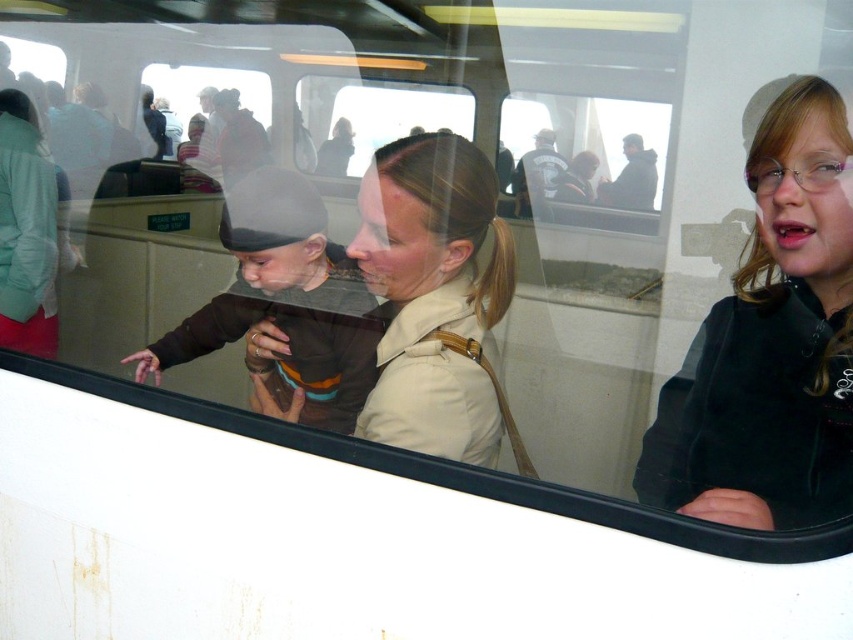
Who is positioned more to the left, beige leather jacket at center or dark gray jacket at upper center?

beige leather jacket at center is more to the left.

In the scene shown: Can you confirm if beige leather jacket at center is taller than dark gray jacket at upper center?

Yes, beige leather jacket at center is taller than dark gray jacket at upper center.

Describe the element at coordinates (433, 292) in the screenshot. Image resolution: width=853 pixels, height=640 pixels. I see `beige leather jacket at center` at that location.

Image resolution: width=853 pixels, height=640 pixels. I want to click on beige leather jacket at center, so click(433, 292).

Between matte brown hat at left and dark gray jacket at upper center, which one is positioned higher?

Positioned higher is dark gray jacket at upper center.

The width and height of the screenshot is (853, 640). Describe the element at coordinates (285, 301) in the screenshot. I see `matte brown hat at left` at that location.

Find the location of a particular element. The height and width of the screenshot is (640, 853). matte brown hat at left is located at coordinates (285, 301).

Who is taller, transparent glass at center or dark gray jacket at upper center?

transparent glass at center is taller.

Can you confirm if transparent glass at center is positioned to the right of dark gray jacket at upper center?

In fact, transparent glass at center is to the left of dark gray jacket at upper center.

The image size is (853, 640). Describe the element at coordinates (589, 157) in the screenshot. I see `transparent glass at center` at that location.

Find the location of a particular element. transparent glass at center is located at coordinates (589, 157).